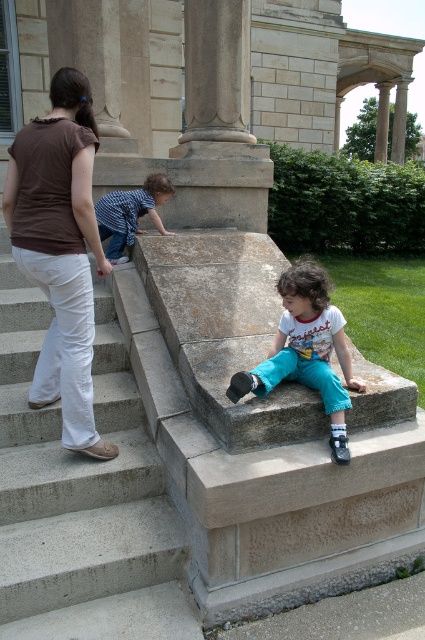
Consider the image. You are a photographer trying to capture the scene outside the classical building. You need to decide whether to focus on the teal cotton pants at lower center or the smooth stone column at upper right. Based on their widths, which object would allow for a tighter crop in your photo?

The teal cotton pants at lower center has a smaller width compared to the smooth stone column at upper right, so it would allow for a tighter crop in the photo.

You are a delivery person holding a package that requires a 30 inch clearance to maneuver safely. You need to navigate through the space between the concrete stairs at center and the brown cotton shirt at upper left. Can you safely pass through this area with the package?

The distance between the concrete stairs at center and the brown cotton shirt at upper left is 27.56 inches, which is less than the required 30 inch clearance. Therefore, you cannot safely pass through this area with the package.